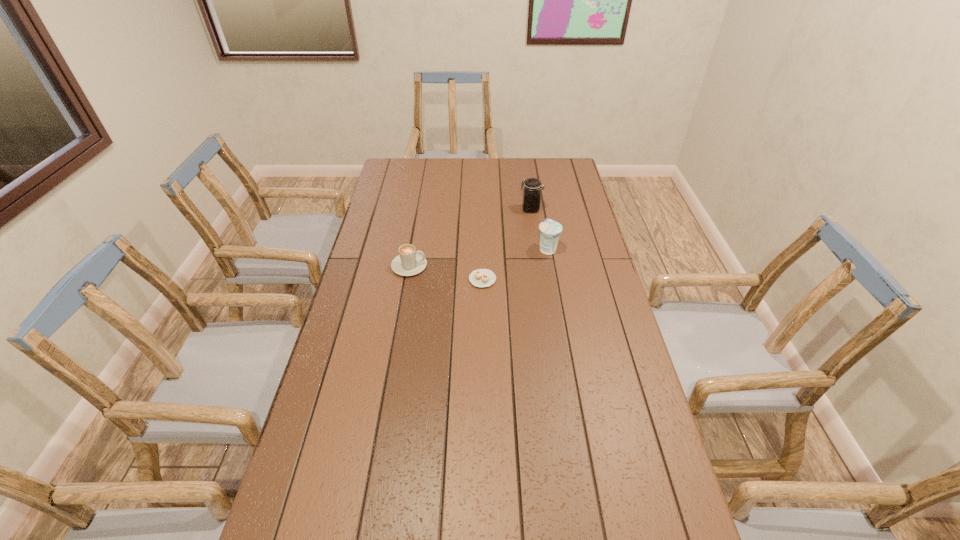
The width and height of the screenshot is (960, 540). I want to click on free space between the second tallest object and the farthest object, so click(x=539, y=229).

Locate an element on the screen. The width and height of the screenshot is (960, 540). empty space between the jar and the leftmost object is located at coordinates (469, 238).

Where is `vacant area that lies between the cupcake and the jar`? The image size is (960, 540). vacant area that lies between the cupcake and the jar is located at coordinates (507, 244).

You are a GUI agent. You are given a task and a screenshot of the screen. Output one action in this format:
    pyautogui.click(x=<x>, y=<y>)
    Task: Click on the free spot between the cappuccino and the cupcake
    The height and width of the screenshot is (540, 960).
    Given the screenshot: What is the action you would take?
    pyautogui.click(x=445, y=273)

At what (x,y) coordinates should I click in order to perform the action: click on free spot between the cappuccino and the jar. Please return your answer as a coordinate pair (x, y). Image resolution: width=960 pixels, height=540 pixels. Looking at the image, I should click on (469, 238).

What are the coordinates of `vacant region between the yogurt and the cappuccino` in the screenshot? It's located at (478, 258).

The image size is (960, 540). In order to click on vacant space in between the leftmost object and the tallest object in this screenshot , I will do `click(469, 238)`.

At what (x,y) coordinates should I click in order to perform the action: click on free space that is in between the leftmost object and the jar. Please return your answer as a coordinate pair (x, y). This screenshot has height=540, width=960. Looking at the image, I should click on coord(469,238).

Locate an element on the screen. free area in between the tallest object and the second tallest object is located at coordinates (539, 229).

Where is `object that stands as the second closest to the third shortest object`? This screenshot has width=960, height=540. object that stands as the second closest to the third shortest object is located at coordinates (531, 198).